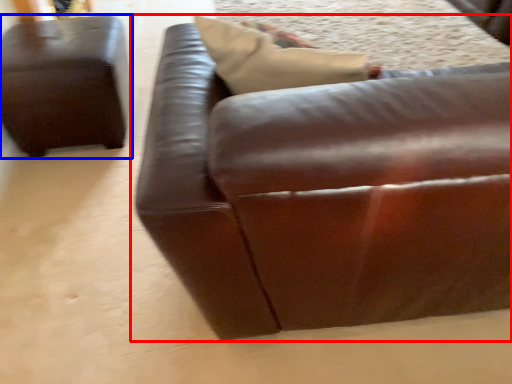
Question: Which of the following is the farthest to the observer, studio couch (highlighted by a red box) or studio couch (highlighted by a blue box)?

Choices:
 (A) studio couch
 (B) studio couch

Answer: (B)